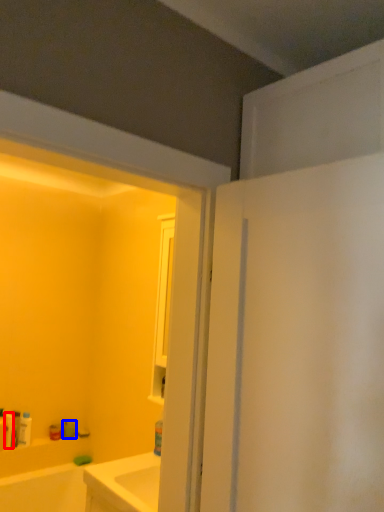
Question: Which of the following is the farthest to the observer, toiletry (highlighted by a red box) or toiletry (highlighted by a blue box)?

Choices:
 (A) toiletry
 (B) toiletry

Answer: (B)